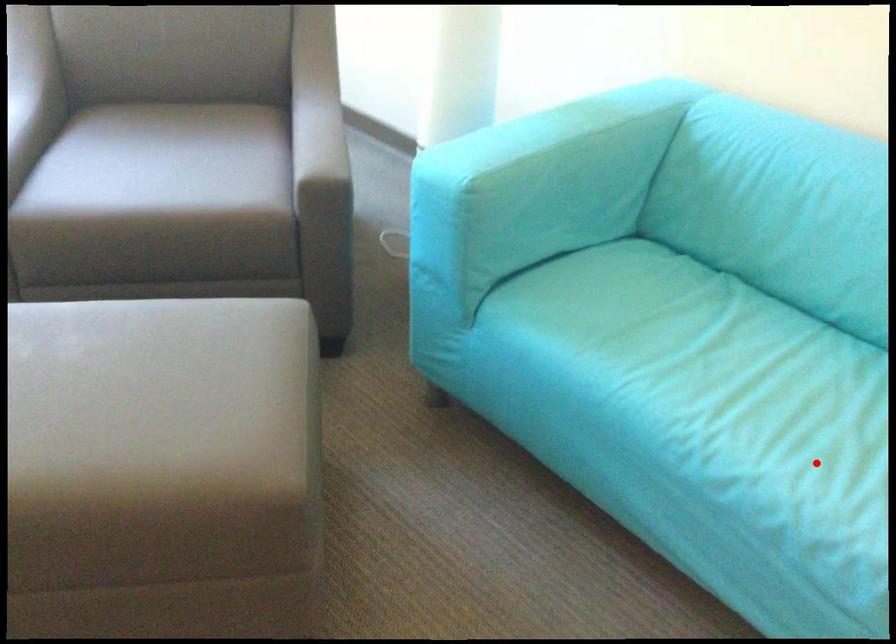
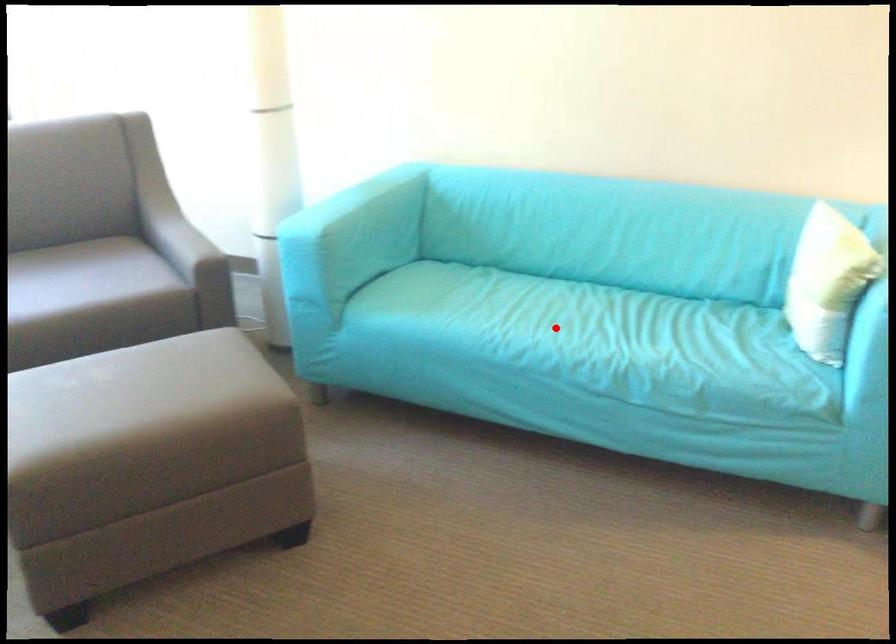
Consider the image. I am providing you with two images of the same scene from different viewpoints. A red point is marked on the first image and another point is marked on the second image. Is the marked point in image1 the same physical position as the marked point in image2?

Yes